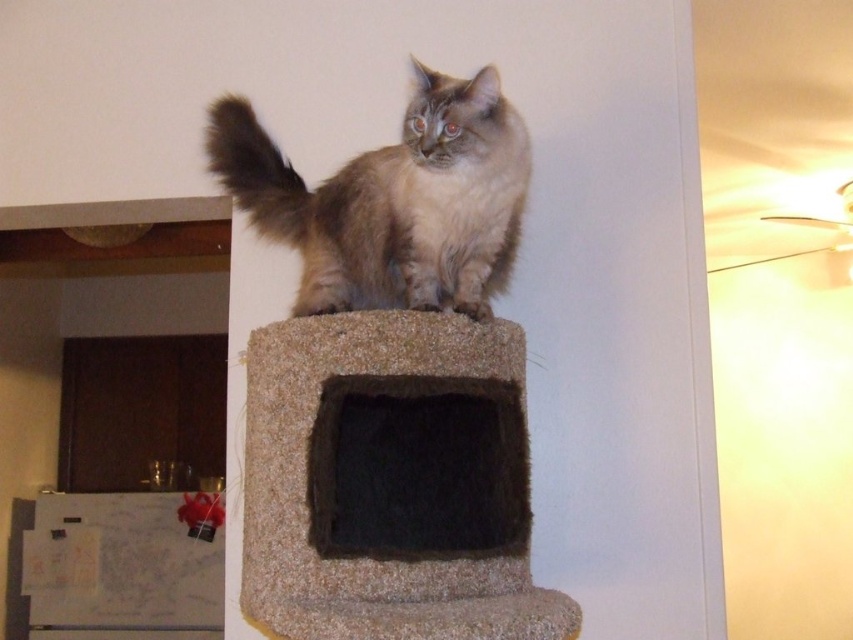
You are a photographer trying to capture a clear shot of the fuzzy beige cat at center and the fuzzy brown tail at upper center. Which object should you focus on first if you want to ensure both are in focus?

The fuzzy beige cat at center is below the fuzzy brown tail at upper center, so focusing on the fuzzy brown tail at upper center first will help ensure both are in focus since it is farther away.